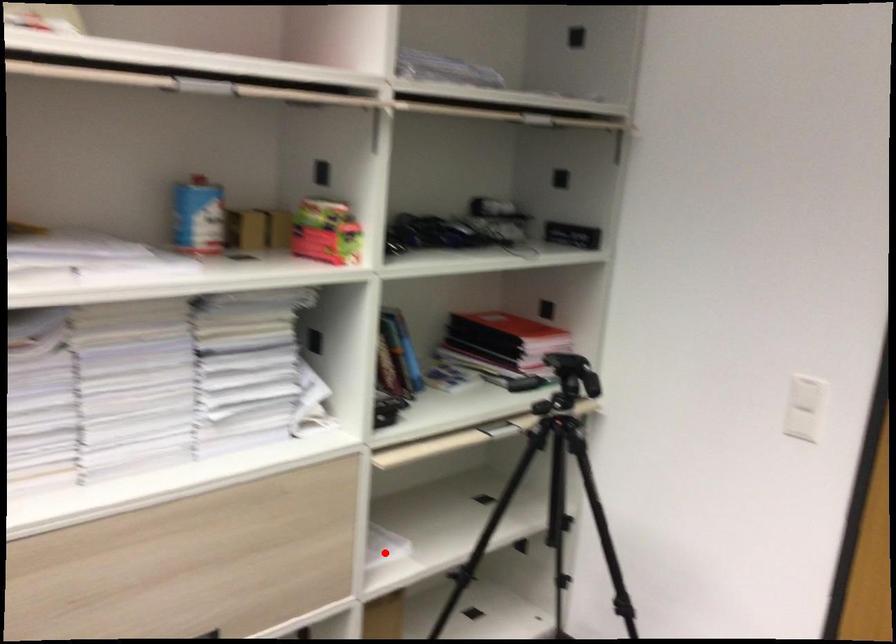
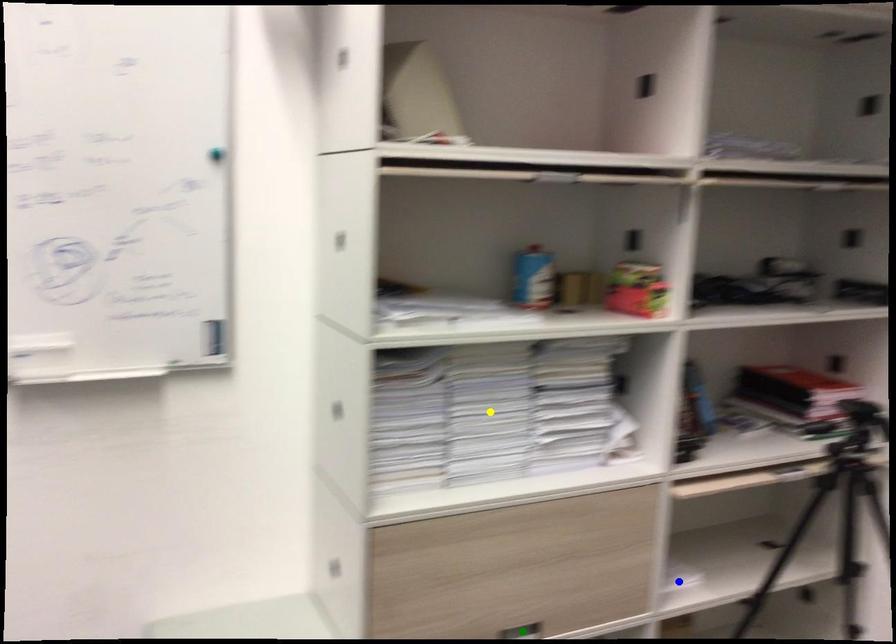
Question: I am providing you with two images of the same scene from different viewpoints. A red point is marked on the first image. You are given multiple points on the second image. Which point in image 2 is actually the same real-world point as the red point in image 1?

Choices:
 (A) green point
 (B) blue point
 (C) yellow point

Answer: (B)